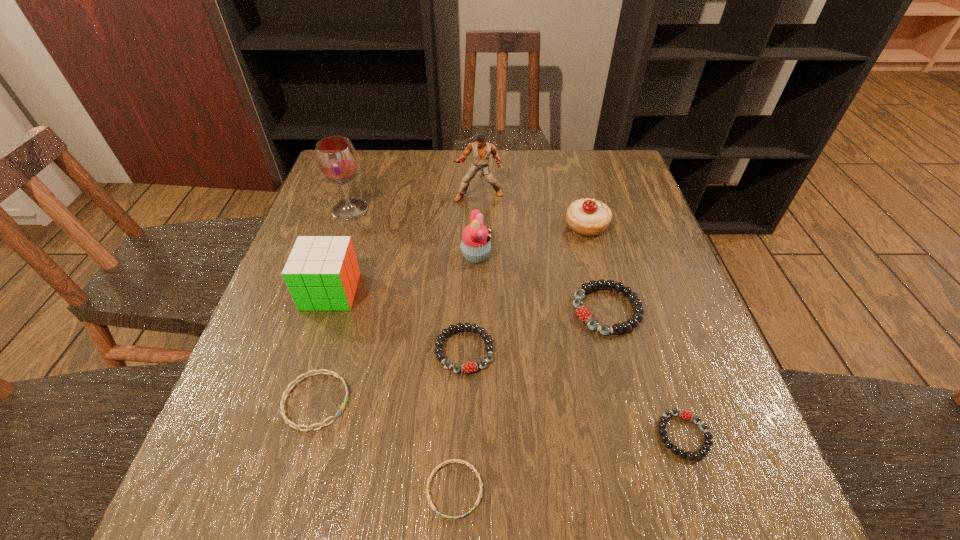
You are a GUI agent. You are given a task and a screenshot of the screen. Output one action in this format:
    pyautogui.click(x=<x>, y=<y>)
    Task: Click on the free point located 0.070m on the right of the biggest black bracelet
    The height and width of the screenshot is (540, 960).
    Given the screenshot: What is the action you would take?
    pyautogui.click(x=674, y=310)

Locate an element on the screen. This screenshot has height=540, width=960. blank space located 0.220m on the left of the leftmost black bracelet is located at coordinates (325, 350).

Identify the location of vacant space located on the surface of the left blue bracelet showing star-shaped elements. The image size is (960, 540). (436, 401).

The image size is (960, 540). Find the location of `free space located 0.170m on the back of the smallest black bracelet`. free space located 0.170m on the back of the smallest black bracelet is located at coordinates (650, 334).

Find the location of a particular element. The height and width of the screenshot is (540, 960). object that is at the far edge is located at coordinates (481, 150).

Where is `object that is at the near edge`? The height and width of the screenshot is (540, 960). object that is at the near edge is located at coordinates (453, 460).

At what (x,y) coordinates should I click in order to perform the action: click on wineglass located at the left edge. Please return your answer as a coordinate pair (x, y). The height and width of the screenshot is (540, 960). Looking at the image, I should click on (336, 158).

Locate an element on the screen. The width and height of the screenshot is (960, 540). cube at the left edge is located at coordinates (322, 273).

The width and height of the screenshot is (960, 540). Identify the location of bracelet that is at the left edge. (287, 421).

The width and height of the screenshot is (960, 540). Identify the location of pastry situated at the right edge. (588, 217).